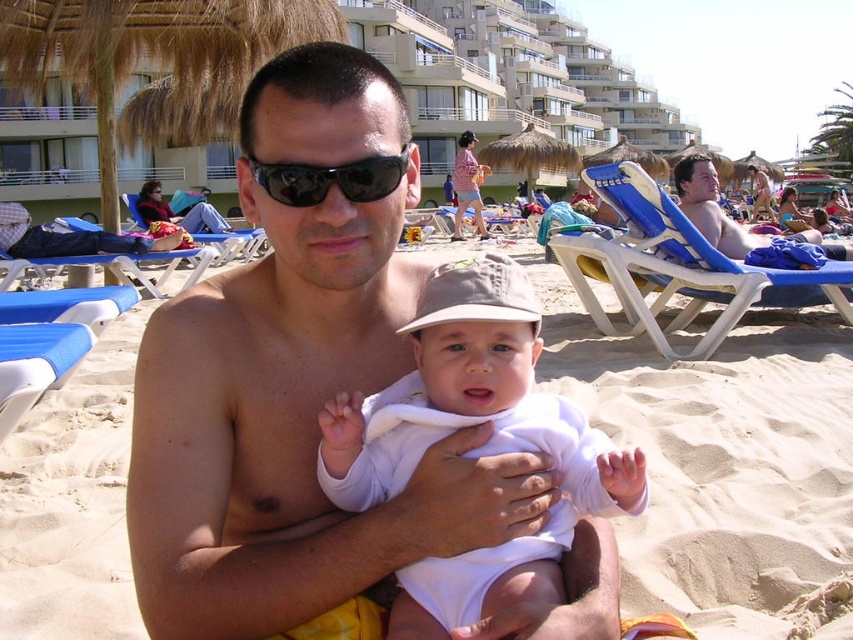
Is the position of blue plastic beach chair at lower left more distant than that of blue plastic beach chair at upper left?

No, it is in front of blue plastic beach chair at upper left.

Between blue plastic beach chair at lower left and blue plastic beach chair at upper left, which one appears on the right side from the viewer's perspective?

blue plastic beach chair at lower left is more to the right.

This screenshot has height=640, width=853. Describe the element at coordinates (48, 340) in the screenshot. I see `blue plastic beach chair at lower left` at that location.

At what (x,y) coordinates should I click in order to perform the action: click on blue plastic beach chair at lower left. Please return your answer as a coordinate pair (x, y). Image resolution: width=853 pixels, height=640 pixels. Looking at the image, I should click on (48, 340).

Does point (764, 400) lie in front of point (239, 253)?

Yes, point (764, 400) is closer to viewer.

Who is more distant from viewer, (65,484) or (225,253)?

Positioned behind is point (225,253).

Is point (97, 340) behind point (206, 214)?

No, it is not.

Where is `sandy beach at center`? sandy beach at center is located at coordinates (724, 465).

Is matte skin man at center below sandy beach at center?

No, matte skin man at center is not below sandy beach at center.

Identify the location of matte skin man at center. (297, 388).